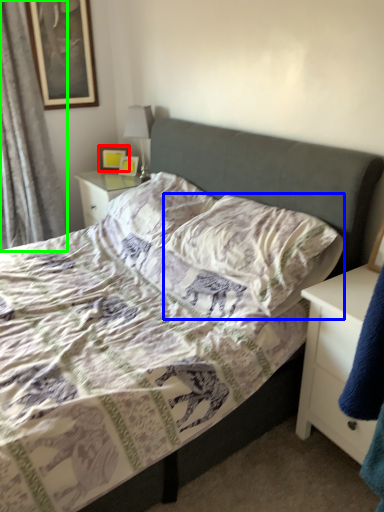
Question: Which is nearer to the picture frame (highlighted by a red box)? pillow (highlighted by a blue box) or curtain (highlighted by a green box).

Choices:
 (A) pillow
 (B) curtain

Answer: (B)